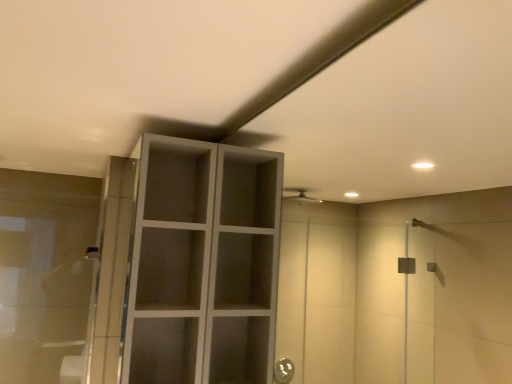
The image size is (512, 384). I want to click on matte gray cabinet at upper center, so click(x=203, y=264).

What do you see at coordinates (203, 264) in the screenshot? I see `matte gray cabinet at upper center` at bounding box center [203, 264].

Locate an element on the screen. The image size is (512, 384). transparent glass cabinet at left is located at coordinates (45, 274).

Describe the element at coordinates (45, 274) in the screenshot. This screenshot has width=512, height=384. I see `transparent glass cabinet at left` at that location.

In order to face transparent glass cabinet at left, should I rotate leftwards or rightwards?

You should look left and rotate roughly 26.288 degrees.

Find the location of a particular element. matte gray cabinet at upper center is located at coordinates (203, 264).

Is matte gray cabinet at upper center at the right side of transparent glass cabinet at left?

Yes, matte gray cabinet at upper center is to the right of transparent glass cabinet at left.

Which object is further away from the camera taking this photo, matte gray cabinet at upper center or transparent glass cabinet at left?

transparent glass cabinet at left.

Is point (237, 161) in front of point (82, 344)?

Yes, point (237, 161) is in front of point (82, 344).

From the image's perspective, is matte gray cabinet at upper center below transparent glass cabinet at left?

No, from the image's perspective, matte gray cabinet at upper center is not beneath transparent glass cabinet at left.

From a real-world perspective, which object rests below the other?

transparent glass cabinet at left.

Is matte gray cabinet at upper center thinner than transparent glass cabinet at left?

No, matte gray cabinet at upper center is not thinner than transparent glass cabinet at left.

Which of these two, matte gray cabinet at upper center or transparent glass cabinet at left, stands taller?

Standing taller between the two is matte gray cabinet at upper center.

Who is smaller, matte gray cabinet at upper center or transparent glass cabinet at left?

transparent glass cabinet at left.

Would you say matte gray cabinet at upper center is outside transparent glass cabinet at left?

matte gray cabinet at upper center is positioned outside transparent glass cabinet at left.

Are matte gray cabinet at upper center and transparent glass cabinet at left making contact?

No, matte gray cabinet at upper center is not touching transparent glass cabinet at left.

Does matte gray cabinet at upper center turn towards transparent glass cabinet at left?

Yes, matte gray cabinet at upper center is turned towards transparent glass cabinet at left.

What's the angular difference between matte gray cabinet at upper center and transparent glass cabinet at left's facing directions?

The facing directions of matte gray cabinet at upper center and transparent glass cabinet at left are 89 degrees apart.

What are the coordinates of `cabinetry below the matte gray cabinet at upper center (from the image's perspective)` in the screenshot? It's located at (45, 274).

Based on their positions, is transparent glass cabinet at left located to the left or right of matte gray cabinet at upper center?

transparent glass cabinet at left is to the left of matte gray cabinet at upper center.

Is transparent glass cabinet at left in front of or behind matte gray cabinet at upper center in the image?

transparent glass cabinet at left is behind matte gray cabinet at upper center.

Which point is more distant from viewer, (47, 306) or (174, 308)?

Positioned behind is point (47, 306).

From the image's perspective, who appears lower, transparent glass cabinet at left or matte gray cabinet at upper center?

From the image's view, transparent glass cabinet at left is below.

In the scene shown: From a real-world perspective, does transparent glass cabinet at left sit lower than matte gray cabinet at upper center?

Indeed, from a real-world perspective, transparent glass cabinet at left is positioned beneath matte gray cabinet at upper center.

Is transparent glass cabinet at left thinner than matte gray cabinet at upper center?

Yes.

Consider the image. Considering the sizes of transparent glass cabinet at left and matte gray cabinet at upper center in the image, is transparent glass cabinet at left taller or shorter than matte gray cabinet at upper center?

In the image, transparent glass cabinet at left appears to be shorter than matte gray cabinet at upper center.

Does transparent glass cabinet at left have a larger size compared to matte gray cabinet at upper center?

No.

Does transparent glass cabinet at left contain matte gray cabinet at upper center?

No.

Would you consider transparent glass cabinet at left to be distant from matte gray cabinet at upper center?

Absolutely, transparent glass cabinet at left is distant from matte gray cabinet at upper center.

Is transparent glass cabinet at left facing towards matte gray cabinet at upper center?

No, transparent glass cabinet at left is not turned towards matte gray cabinet at upper center.

How much distance is there between transparent glass cabinet at left and matte gray cabinet at upper center?

4.65 feet.

The image size is (512, 384). In order to click on cabinetry on the left of matte gray cabinet at upper center in this screenshot , I will do `click(45, 274)`.

Image resolution: width=512 pixels, height=384 pixels. Find the location of `cupboard lying above the transparent glass cabinet at left (from the image's perspective)`. cupboard lying above the transparent glass cabinet at left (from the image's perspective) is located at coordinates (203, 264).

The height and width of the screenshot is (384, 512). I want to click on cabinetry below the matte gray cabinet at upper center (from the image's perspective), so click(45, 274).